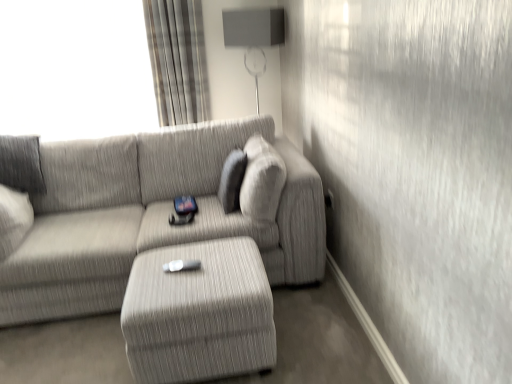
Find the location of `free spot behind white matte wii controller at center`. free spot behind white matte wii controller at center is located at coordinates (191, 251).